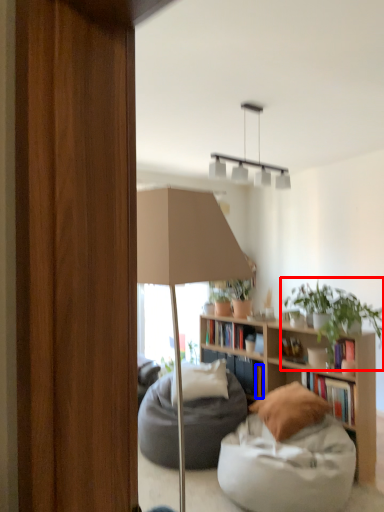
Question: Among these objects, which one is farthest to the camera, houseplant (highlighted by a red box) or book (highlighted by a blue box)?

Choices:
 (A) houseplant
 (B) book

Answer: (B)